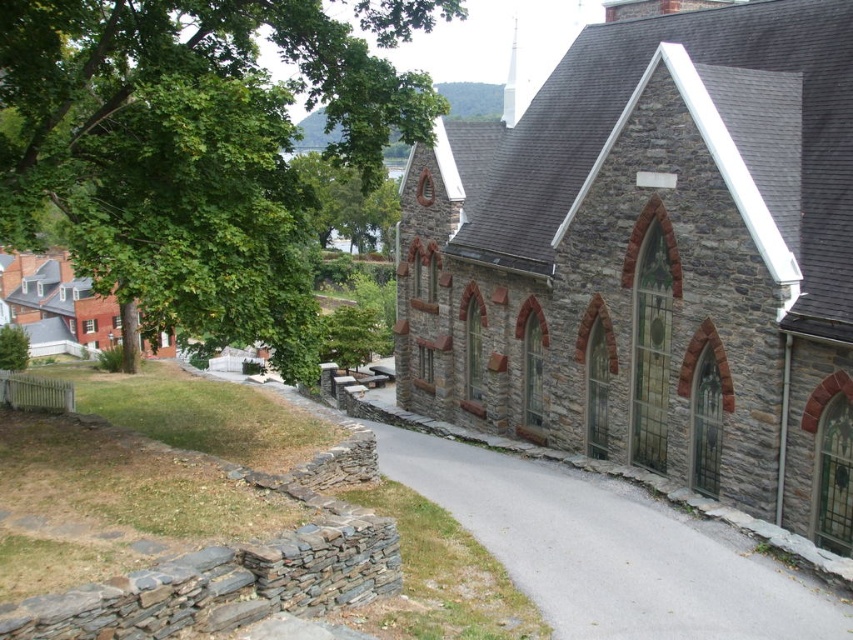
Question: Which of the following is the closest to the observer?

Choices:
 (A) (755, 250)
 (B) (109, 163)

Answer: (B)

Question: Which object appears closest to the camera in this image?

Choices:
 (A) green leafy tree at upper left
 (B) stone church at center

Answer: (A)

Question: Considering the relative positions of stone church at center and green leafy tree at upper left in the image provided, where is stone church at center located with respect to green leafy tree at upper left?

Choices:
 (A) right
 (B) left

Answer: (A)

Question: Is stone church at center closer to the viewer compared to green leafy tree at upper left?

Choices:
 (A) no
 (B) yes

Answer: (A)

Question: Is stone church at center further to camera compared to green leafy tree at upper left?

Choices:
 (A) no
 (B) yes

Answer: (B)